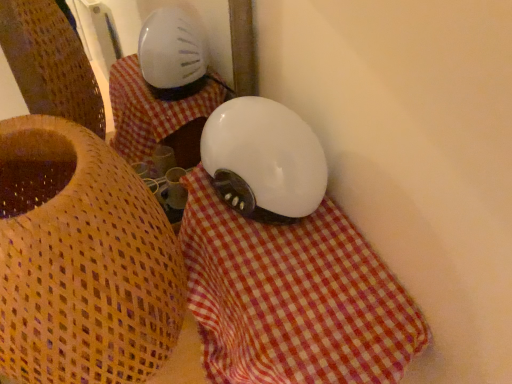
Describe the element at coordinates (293, 298) in the screenshot. I see `white checkered cloth at center` at that location.

Measure the distance between matte white lampshade at upper center and camera.

matte white lampshade at upper center is 11.22 inches from camera.

Locate an element on the screen. white checkered cloth at center is located at coordinates (293, 298).

Locate an element on the screen. This screenshot has width=512, height=384. helmet on the left side of white checkered cloth at center is located at coordinates (264, 160).

How much distance is there between white glossy helmet at center and white checkered cloth at center?

white glossy helmet at center and white checkered cloth at center are 3.96 inches apart.

From the picture: Can you confirm if white glossy helmet at center is thinner than white checkered cloth at center?

Yes.

Is there a large distance between white glossy helmet at center and white checkered cloth at center?

No.

Does white checkered cloth at center come behind matte white lampshade at upper center?

Yes, white checkered cloth at center is further from the viewer.

Considering the positions of objects white checkered cloth at center and matte white lampshade at upper center in the image provided, who is more to the left, white checkered cloth at center or matte white lampshade at upper center?

matte white lampshade at upper center.

Would you say white checkered cloth at center is inside or outside matte white lampshade at upper center?

white checkered cloth at center is not enclosed by matte white lampshade at upper center.

From the image's perspective, does white checkered cloth at center appear lower than matte white lampshade at upper center?

Indeed, from the image's perspective, white checkered cloth at center is shown beneath matte white lampshade at upper center.

Between matte white lampshade at upper center and white glossy helmet at center, which one has smaller size?

With smaller size is white glossy helmet at center.

How much distance is there between matte white lampshade at upper center and white glossy helmet at center?

The distance of matte white lampshade at upper center from white glossy helmet at center is 7.84 inches.

Is matte white lampshade at upper center next to white glossy helmet at center?

matte white lampshade at upper center is not next to white glossy helmet at center, and they're not touching.

Does matte white lampshade at upper center come behind white glossy helmet at center?

No.

Is white checkered cloth at center in front of or behind white glossy helmet at center in the image?

Clearly, white checkered cloth at center is in front of white glossy helmet at center.

Is white checkered cloth at center aimed at white glossy helmet at center?

No, white checkered cloth at center is not aimed at white glossy helmet at center.

Who is bigger, white checkered cloth at center or white glossy helmet at center?

white checkered cloth at center is bigger.

Would you say white checkered cloth at center is a long distance from white glossy helmet at center?

No, there isn't a large distance between white checkered cloth at center and white glossy helmet at center.

From the image's perspective, between white glossy helmet at center and matte white lampshade at upper center, which one is located above?

white glossy helmet at center appears higher in the image.

Is the depth of white glossy helmet at center less than that of matte white lampshade at upper center?

No, white glossy helmet at center is further to the viewer.

How much distance is there between white glossy helmet at center and matte white lampshade at upper center?

19.92 centimeters.

From a real-world perspective, between white glossy helmet at center and matte white lampshade at upper center, who is vertically lower?

matte white lampshade at upper center.

From the image's perspective, is matte white lampshade at upper center above white checkered cloth at center?

Yes, from the image's perspective, matte white lampshade at upper center is over white checkered cloth at center.

Which of these two, matte white lampshade at upper center or white checkered cloth at center, stands taller?

With more height is matte white lampshade at upper center.

Does matte white lampshade at upper center have a smaller size compared to white checkered cloth at center?

Actually, matte white lampshade at upper center might be larger than white checkered cloth at center.

Is white checkered cloth at center at the back of matte white lampshade at upper center?

No, matte white lampshade at upper center's orientation is not away from white checkered cloth at center.

In the image, there is a white checkered cloth at center. What are the coordinates of `helmet above it (from the image's perspective)` in the screenshot? It's located at (264, 160).

Where is `blanket below the matte white lampshade at upper center (from the image's perspective)`? blanket below the matte white lampshade at upper center (from the image's perspective) is located at coordinates (293, 298).

From the image, which object appears to be farther from white checkered cloth at center, white glossy helmet at center or matte white lampshade at upper center?

The object further to white checkered cloth at center is matte white lampshade at upper center.

When comparing their distances from white glossy helmet at center, does white checkered cloth at center or matte white lampshade at upper center seem closer?

white checkered cloth at center is closer to white glossy helmet at center.

Estimate the real-world distances between objects in this image. Which object is further from white glossy helmet at center, matte white lampshade at upper center or white checkered cloth at center?

matte white lampshade at upper center is further to white glossy helmet at center.

From the image, which object appears to be farther from white checkered cloth at center, matte white lampshade at upper center or white glossy helmet at center?

Among the two, matte white lampshade at upper center is located further to white checkered cloth at center.

Estimate the real-world distances between objects in this image. Which object is further from matte white lampshade at upper center, white glossy helmet at center or white checkered cloth at center?

Among the two, white glossy helmet at center is located further to matte white lampshade at upper center.

Looking at the image, which one is located closer to matte white lampshade at upper center, white checkered cloth at center or white glossy helmet at center?

→ The object closer to matte white lampshade at upper center is white checkered cloth at center.

Image resolution: width=512 pixels, height=384 pixels. I want to click on helmet located between matte white lampshade at upper center and white checkered cloth at center in the left-right direction, so click(264, 160).